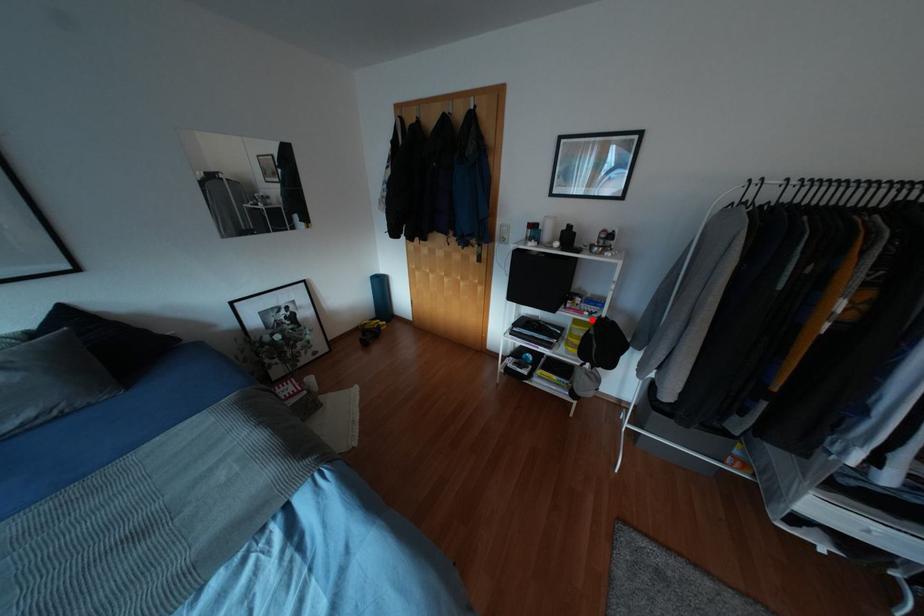
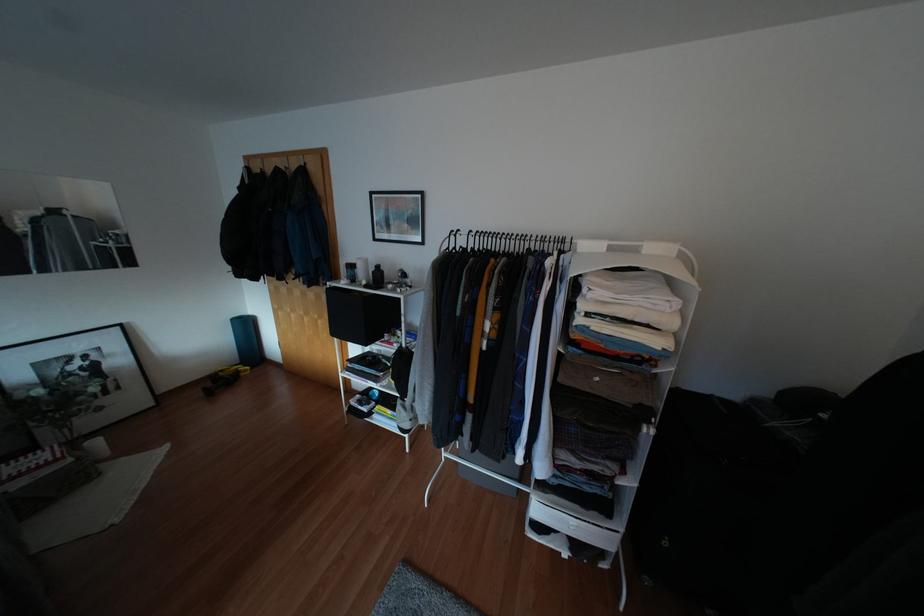
Question: I am providing you with two images of the same scene from different viewpoints. Image1 has a red point marked. In image2, the corresponding 3D location appears at what relative position? Reply with the corresponding letter.

Choices:
 (A) Closer
 (B) Farther

Answer: (B)